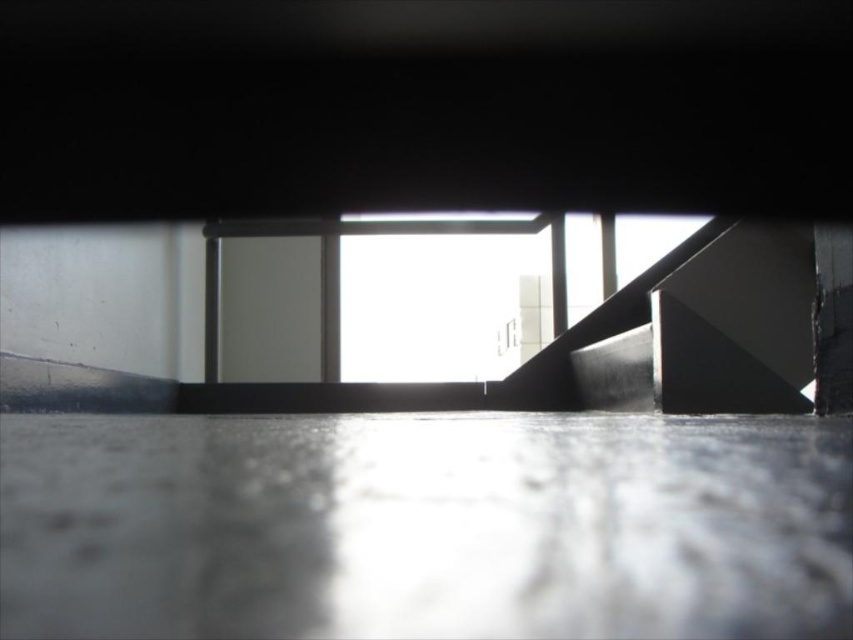
Which is below, matte black stair at right or transparent glass window at center?

matte black stair at right is lower down.

Which is more to the right, matte black stair at right or transparent glass window at center?

From the viewer's perspective, matte black stair at right appears more on the right side.

Who is more forward, (x=776, y=349) or (x=215, y=289)?

Positioned in front is point (x=776, y=349).

Locate an element on the screen. matte black stair at right is located at coordinates (701, 328).